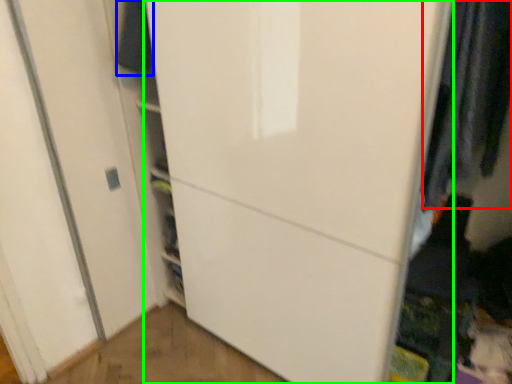
Question: Which object is the closest to the clothing (highlighted by a red box)? Choose among these: clothing (highlighted by a blue box) or door (highlighted by a green box).

Choices:
 (A) clothing
 (B) door

Answer: (B)